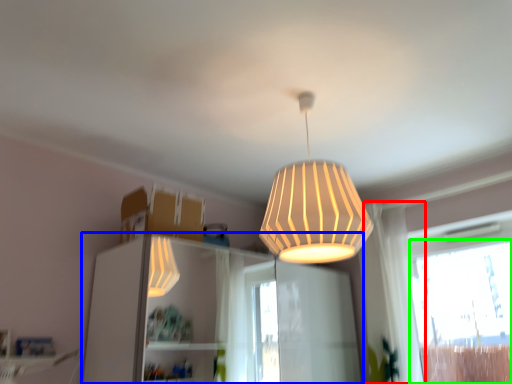
Question: Which object is positioned farthest from curtain (highlighted by a red box)? Select from dresser (highlighted by a blue box) and window (highlighted by a green box).

Choices:
 (A) dresser
 (B) window

Answer: (A)